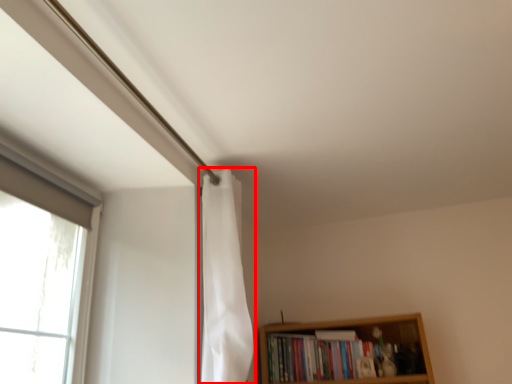
Question: From the image's perspective, what is the correct spatial relationship of shower curtain (annotated by the red box) in relation to book?

Choices:
 (A) above
 (B) below

Answer: (A)